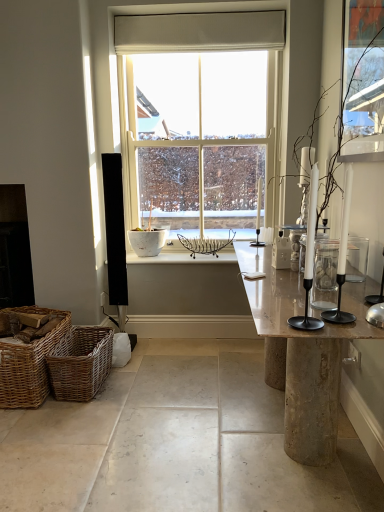
Question: Can you confirm if clear glass jar at right is smaller than woven brown picnic basket at lower left, the second picnic basket when ordered from right to left?

Choices:
 (A) yes
 (B) no

Answer: (A)

Question: Is clear glass jar at right far from woven brown picnic basket at lower left, the second picnic basket when ordered from right to left?

Choices:
 (A) no
 (B) yes

Answer: (B)

Question: Would you say woven brown picnic basket at lower left, the second picnic basket when ordered from right to left, is part of clear glass jar at right's contents?

Choices:
 (A) yes
 (B) no

Answer: (B)

Question: Considering the relative sizes of clear glass jar at right and woven brown picnic basket at lower left, the second picnic basket when ordered from right to left, in the image provided, is clear glass jar at right taller than woven brown picnic basket at lower left, the second picnic basket when ordered from right to left,?

Choices:
 (A) no
 (B) yes

Answer: (A)

Question: Does clear glass jar at right have a larger size compared to woven brown picnic basket at lower left, which appears as the first picnic basket when viewed from the left?

Choices:
 (A) no
 (B) yes

Answer: (A)

Question: Based on their sizes in the image, would you say white glossy candle holder at center is bigger or smaller than smooth concrete table at lower center?

Choices:
 (A) small
 (B) big

Answer: (A)

Question: Is white glossy candle holder at center in front of or behind smooth concrete table at lower center in the image?

Choices:
 (A) behind
 (B) front

Answer: (A)

Question: From a real-world perspective, is white glossy candle holder at center above or below smooth concrete table at lower center?

Choices:
 (A) above
 (B) below

Answer: (A)

Question: From their relative heights in the image, would you say white glossy candle holder at center is taller or shorter than smooth concrete table at lower center?

Choices:
 (A) tall
 (B) short

Answer: (A)

Question: From their relative heights in the image, would you say black glass fireplace at left is taller or shorter than clear glass jar at right?

Choices:
 (A) short
 (B) tall

Answer: (B)

Question: Considering the positions of black glass fireplace at left and clear glass jar at right in the image, is black glass fireplace at left wider or thinner than clear glass jar at right?

Choices:
 (A) thin
 (B) wide

Answer: (B)

Question: In terms of size, does black glass fireplace at left appear bigger or smaller than clear glass jar at right?

Choices:
 (A) small
 (B) big

Answer: (B)

Question: From a real-world perspective, relative to clear glass jar at right, is black glass fireplace at left vertically above or below?

Choices:
 (A) below
 (B) above

Answer: (A)

Question: From the image's perspective, relative to marble table at center, is woven brown picnic basket at lower left, which is counted as the second picnic basket, starting from the left, above or below?

Choices:
 (A) above
 (B) below

Answer: (B)

Question: Is woven brown picnic basket at lower left, arranged as the 1th picnic basket when viewed from the right, spatially inside marble table at center, or outside of it?

Choices:
 (A) inside
 (B) outside

Answer: (B)